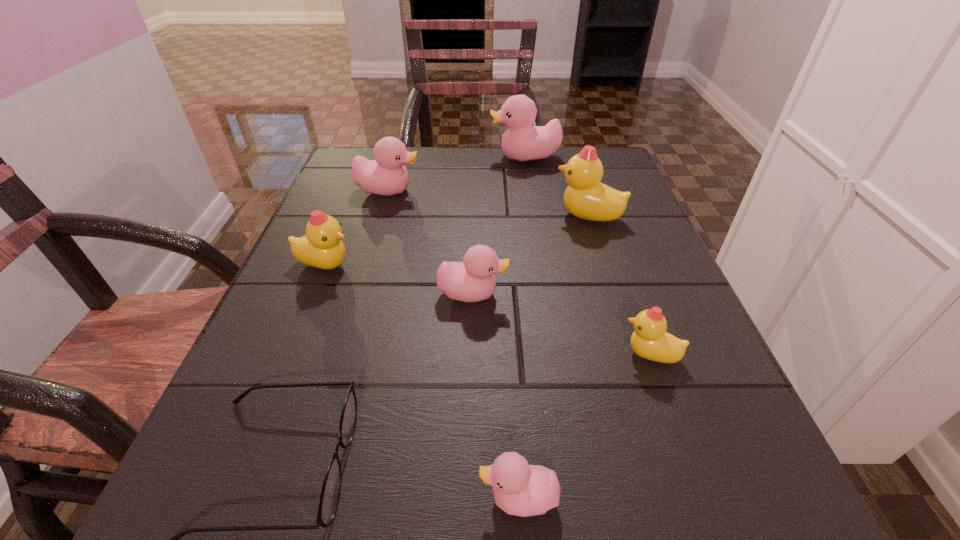
Where is `duckling that is the second nearest to the second biggest pink duckling`? The image size is (960, 540). duckling that is the second nearest to the second biggest pink duckling is located at coordinates (321, 247).

You are a GUI agent. You are given a task and a screenshot of the screen. Output one action in this format:
    pyautogui.click(x=<x>, y=<y>)
    Task: Click on the pink duckling that is the closest to the spectacles
    The width and height of the screenshot is (960, 540).
    Given the screenshot: What is the action you would take?
    pyautogui.click(x=520, y=489)

Locate an element on the screen. This screenshot has width=960, height=540. pink duckling that is the fourth closest one to the spectacles is located at coordinates (521, 142).

Point out which yellow duckling is positioned as the nearest to the fifth farthest object. Please provide its 2D coordinates. Your answer should be formatted as a tuple, i.e. [(x, y)], where the tuple contains the x and y coordinates of a point satisfying the conditions above.

[(321, 247)]

Choose which yellow duckling is the third nearest neighbor to the third farthest pink duckling. Please provide its 2D coordinates. Your answer should be formatted as a tuple, i.e. [(x, y)], where the tuple contains the x and y coordinates of a point satisfying the conditions above.

[(587, 198)]